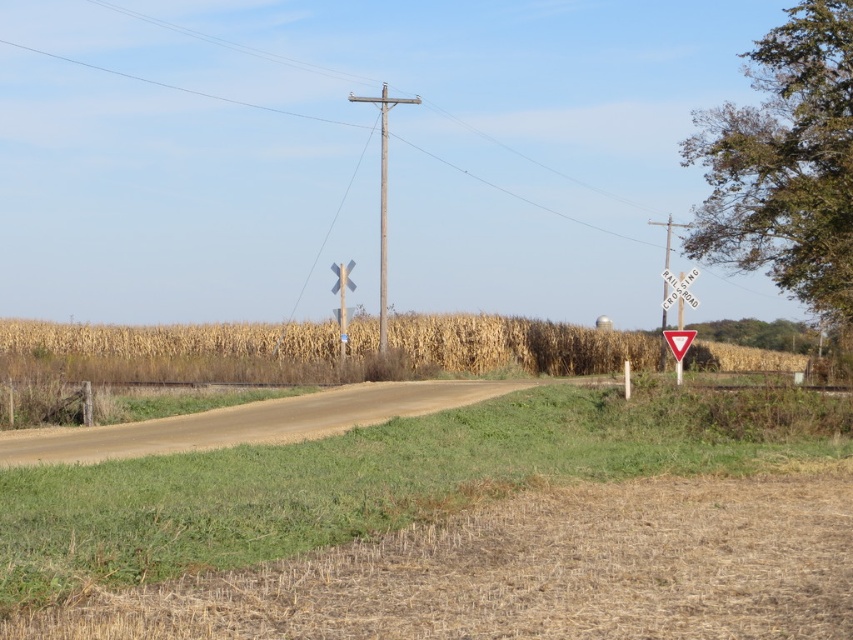
Question: Is weathered wood telegraph pole at center below metallic pole at right?

Choices:
 (A) yes
 (B) no

Answer: (B)

Question: Does weathered wood telegraph pole at center come in front of red plastic triangle at center?

Choices:
 (A) no
 (B) yes

Answer: (A)

Question: Considering the real-world distances, which object is farthest from the red plastic triangle at center?

Choices:
 (A) weathered wood telegraph pole at center
 (B) green grass at center

Answer: (A)

Question: In this image, where is green grass at center located relative to metallic pole at right?

Choices:
 (A) left
 (B) right

Answer: (A)

Question: Which point is closer to the camera?

Choices:
 (A) (171, 461)
 (B) (378, 342)
 (C) (669, 232)
 (D) (700, 348)

Answer: (A)

Question: Which point is farther to the camera?

Choices:
 (A) (669, 244)
 (B) (520, 353)
 (C) (650, 474)

Answer: (A)